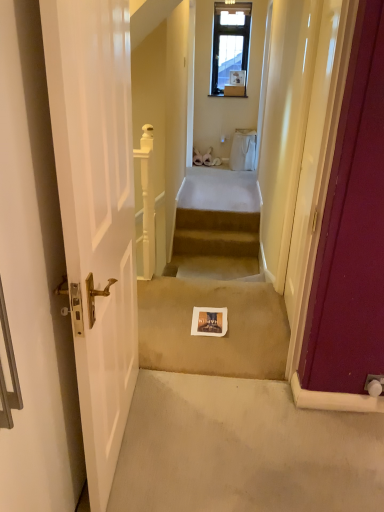
Question: Considering the positions of white paper at center and beige carpeted stairs at center in the image, is white paper at center bigger or smaller than beige carpeted stairs at center?

Choices:
 (A) small
 (B) big

Answer: (B)

Question: From the image's perspective, is white paper at center above or below beige carpeted stairs at center?

Choices:
 (A) below
 (B) above

Answer: (A)

Question: Which object is positioned closest to the white paper at center?

Choices:
 (A) matte burgundy door at right, placed as the second door when sorted from left to right
 (B) beige carpeted stairs at center
 (C) white glossy door at left, the second door when ordered from right to left

Answer: (A)

Question: Estimate the real-world distances between objects in this image. Which object is closer to the beige carpeted stairs at center?

Choices:
 (A) white paper at center
 (B) matte burgundy door at right, placed as the second door when sorted from left to right
 (C) white glossy door at left, the 1th door when ordered from left to right

Answer: (A)